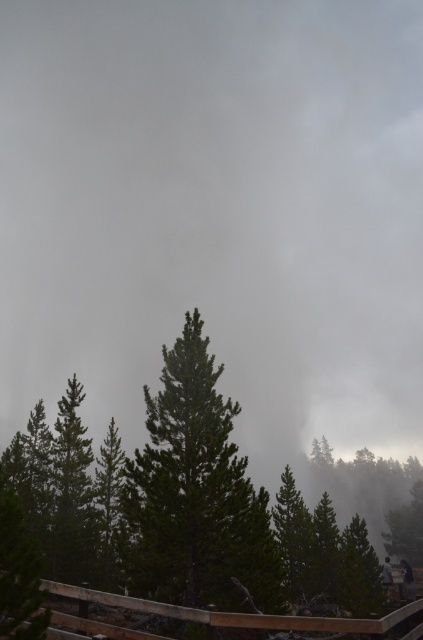
Question: Which point appears closest to the camera in this image?

Choices:
 (A) (252, 614)
 (B) (390, 566)
 (C) (150, 499)

Answer: (A)

Question: Does green matte tree at center appear on the right side of white snowboarder at lower right?

Choices:
 (A) no
 (B) yes

Answer: (A)

Question: Which object appears farthest from the camera in this image?

Choices:
 (A) brown wooden rail at bottom
 (B) green matte tree at center

Answer: (B)

Question: Is green matte tree at center to the right of brown wooden rail at bottom from the viewer's perspective?

Choices:
 (A) no
 (B) yes

Answer: (A)

Question: Which point appears farthest from the camera in this image?

Choices:
 (A) (307, 627)
 (B) (219, 406)
 (C) (381, 577)

Answer: (C)

Question: Can you confirm if green matte tree at center is smaller than white snowboarder at lower right?

Choices:
 (A) no
 (B) yes

Answer: (A)